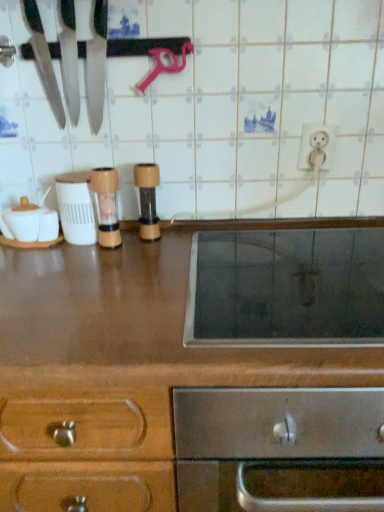
Question: Is wooden pepper grinder at center, the second appliance in the left-to-right sequence, outside white plastic container at center, placed as the 3th appliance when sorted from right to left?

Choices:
 (A) yes
 (B) no

Answer: (A)

Question: Is wooden pepper grinder at center, the second appliance in the left-to-right sequence, at the right side of white plastic container at center, which is the first appliance from left to right?

Choices:
 (A) yes
 (B) no

Answer: (A)

Question: Is white plastic container at center, placed as the 3th appliance when sorted from right to left, inside wooden pepper grinder at center, the second appliance in the left-to-right sequence?

Choices:
 (A) no
 (B) yes

Answer: (A)

Question: Does wooden pepper grinder at center, the second appliance in the left-to-right sequence, appear on the left side of white plastic container at center, placed as the 3th appliance when sorted from right to left?

Choices:
 (A) no
 (B) yes

Answer: (A)

Question: From the image's perspective, is wooden pepper grinder at center, placed as the second appliance when sorted from right to left, under white plastic container at center, which is the first appliance from left to right?

Choices:
 (A) yes
 (B) no

Answer: (A)

Question: Choose the correct answer: Is wooden pepper grinder at center, the second appliance in the left-to-right sequence, inside shiny silver knife at upper left, marked as the 2th knife in a right-to-left arrangement, or outside it?

Choices:
 (A) outside
 (B) inside

Answer: (A)

Question: Relative to shiny silver knife at upper left, marked as the 2th knife in a right-to-left arrangement, is wooden pepper grinder at center, the second appliance in the left-to-right sequence, in front or behind?

Choices:
 (A) front
 (B) behind

Answer: (B)

Question: In the image, is wooden pepper grinder at center, the second appliance in the left-to-right sequence, on the left side or the right side of shiny silver knife at upper left, marked as the 2th knife in a right-to-left arrangement?

Choices:
 (A) right
 (B) left

Answer: (A)

Question: Is wooden pepper grinder at center, the second appliance in the left-to-right sequence, taller or shorter than shiny silver knife at upper left, marked as the 2th knife in a right-to-left arrangement?

Choices:
 (A) short
 (B) tall

Answer: (A)

Question: In terms of width, does shiny silver knife at upper left, acting as the first knife starting from the left, look wider or thinner when compared to stainless steel oven at center?

Choices:
 (A) thin
 (B) wide

Answer: (A)

Question: From the image's perspective, is shiny silver knife at upper left, marked as the 2th knife in a right-to-left arrangement, above or below stainless steel oven at center?

Choices:
 (A) above
 (B) below

Answer: (A)

Question: Is shiny silver knife at upper left, marked as the 2th knife in a right-to-left arrangement, taller or shorter than stainless steel oven at center?

Choices:
 (A) tall
 (B) short

Answer: (B)

Question: Does point (34, 24) appear closer or farther from the camera than point (87, 321)?

Choices:
 (A) closer
 (B) farther

Answer: (B)

Question: From the image's perspective, relative to white glossy electric outlet at upper right, is wooden pepper grinder at center, placed as the second appliance when sorted from right to left, above or below?

Choices:
 (A) below
 (B) above

Answer: (A)

Question: Looking at their shapes, would you say wooden pepper grinder at center, placed as the second appliance when sorted from right to left, is wider or thinner than white glossy electric outlet at upper right?

Choices:
 (A) wide
 (B) thin

Answer: (A)